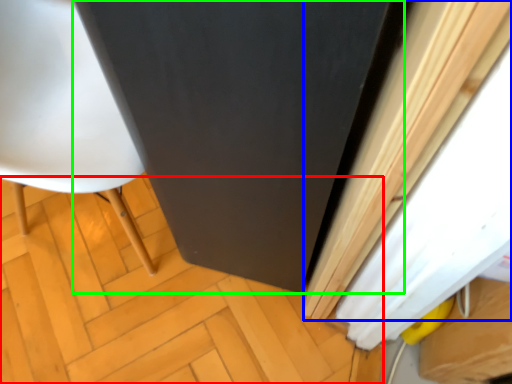
Question: Estimate the real-world distances between objects in this image. Which object is farther from plywood (highlighted by a red box), curtain (highlighted by a blue box) or screen door (highlighted by a green box)?

Choices:
 (A) curtain
 (B) screen door

Answer: (A)